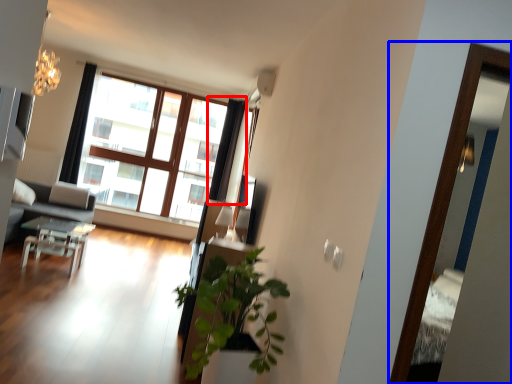
Question: Which object appears closest to the camera in this image, curtain (highlighted by a red box) or screen door (highlighted by a blue box)?

Choices:
 (A) curtain
 (B) screen door

Answer: (B)